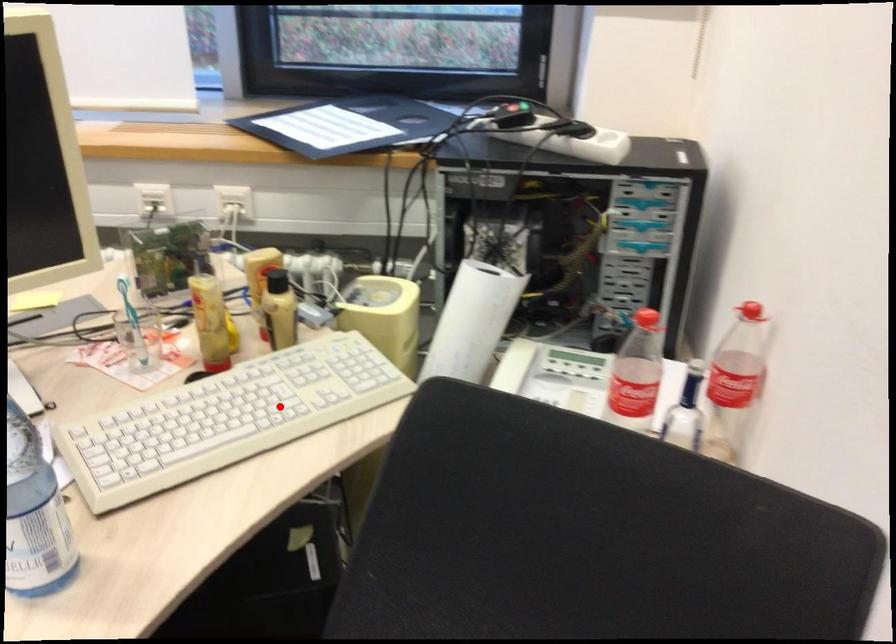
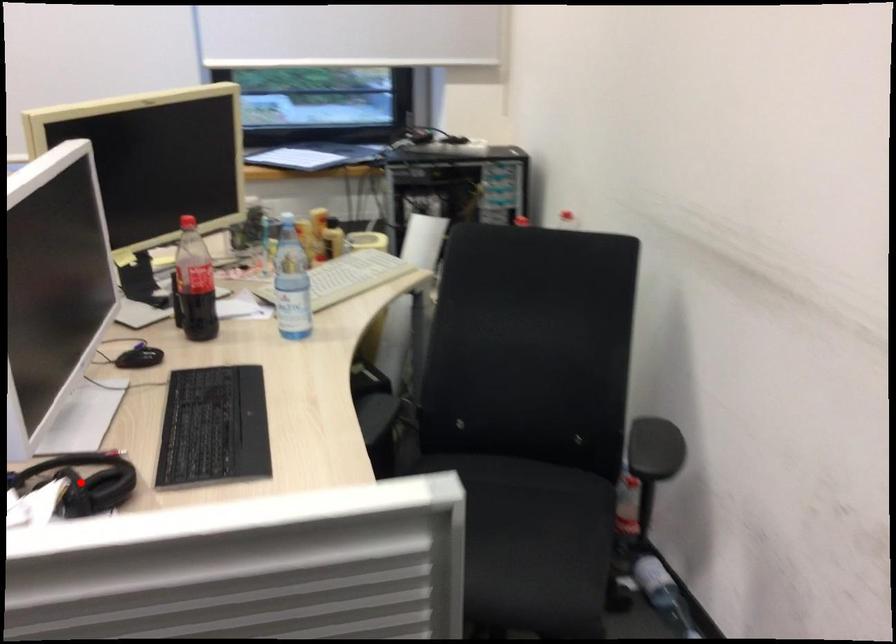
I am providing you with two images of the same scene from different viewpoints. A red point is marked on the first image and another point is marked on the second image. Is the marked point in image1 the same physical position as the marked point in image2?

No